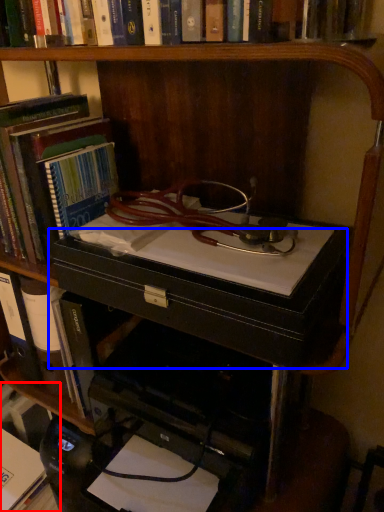
Question: Which point is further to the camera, book (highlighted by a red box) or drawer (highlighted by a blue box)?

Choices:
 (A) book
 (B) drawer

Answer: (A)